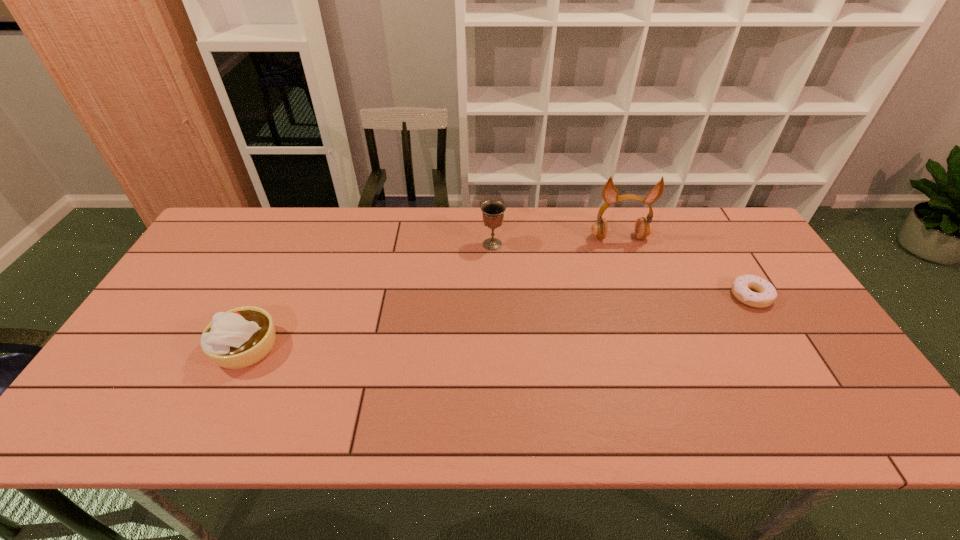
Select which object is the second closest to the shortest object. Please provide its 2D coordinates. Your answer should be formatted as a tuple, i.e. [(x, y)], where the tuple contains the x and y coordinates of a point satisfying the conditions above.

[(493, 211)]

The height and width of the screenshot is (540, 960). In order to click on object that stands as the third closest to the whipped cream in this screenshot , I will do `click(741, 286)`.

I want to click on vacant space that satisfies the following two spatial constraints: 1. on the back side of the chalice; 2. on the right side of the leftmost object, so click(295, 245).

Find the location of a particular element. free location that satisfies the following two spatial constraints: 1. on the front-facing side of the doughnut; 2. on the left side of the second object from right to left is located at coordinates point(639,296).